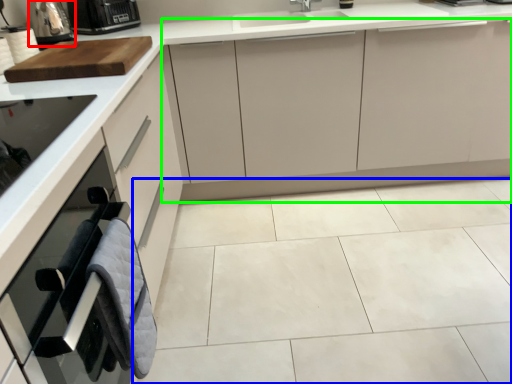
Question: Which object is the farthest from appliance (highlighted by a red box)? Choose among these: ceramic tile (highlighted by a blue box) or cabinetry (highlighted by a green box).

Choices:
 (A) ceramic tile
 (B) cabinetry

Answer: (A)